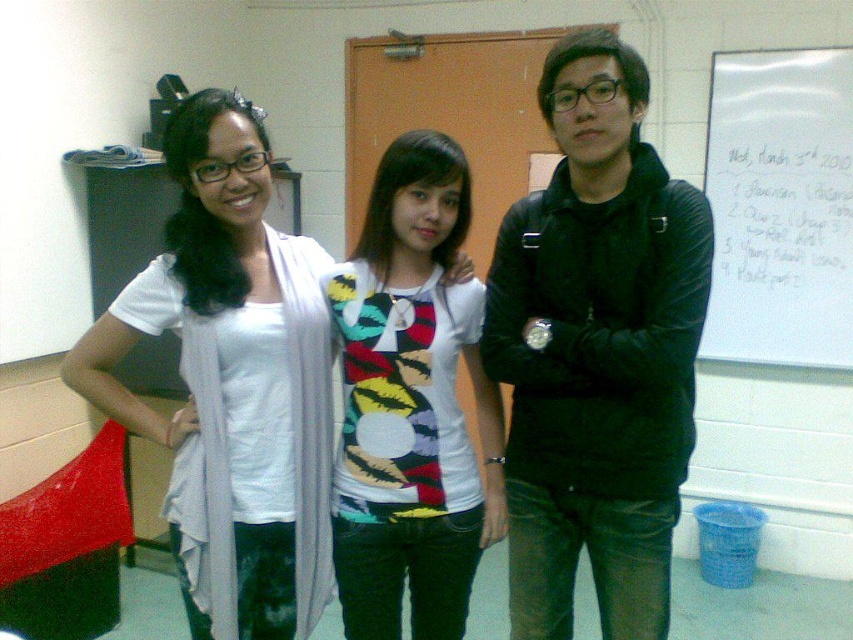
Can you confirm if black matte jacket at center is thinner than multicolored jersey at center?

No, black matte jacket at center is not thinner than multicolored jersey at center.

Which is above, black matte jacket at center or multicolored jersey at center?

Positioned higher is black matte jacket at center.

At what (x,y) coordinates should I click in order to perform the action: click on black matte jacket at center. Please return your answer as a coordinate pair (x, y). Looking at the image, I should click on (596, 349).

Which is behind, point (566, 636) or point (193, 115)?

The point (566, 636) is behind.

Is black matte jacket at center taller than white matte scarf at left?

Indeed, black matte jacket at center has a greater height compared to white matte scarf at left.

Measure the distance between black matte jacket at center and camera.

They are 1.42 meters apart.

The height and width of the screenshot is (640, 853). Identify the location of black matte jacket at center. 596,349.

Between multicolored jersey at center and white paper at upper right, which one appears on the right side from the viewer's perspective?

Positioned to the right is white paper at upper right.

Which is in front, point (461, 636) or point (749, 196)?

Point (461, 636)

This screenshot has width=853, height=640. I want to click on multicolored jersey at center, so click(x=412, y=403).

Find the location of a particular element. The height and width of the screenshot is (640, 853). multicolored jersey at center is located at coordinates (412, 403).